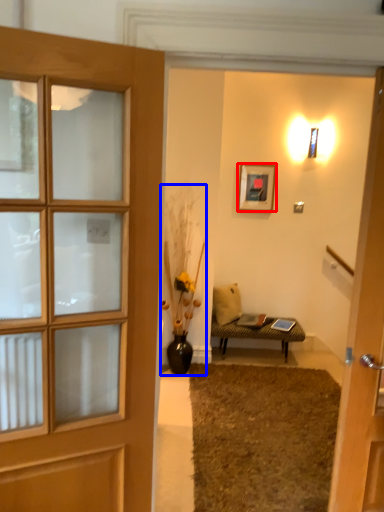
Question: Which object appears farthest to the camera in this image, picture frame (highlighted by a red box) or houseplant (highlighted by a blue box)?

Choices:
 (A) picture frame
 (B) houseplant

Answer: (A)